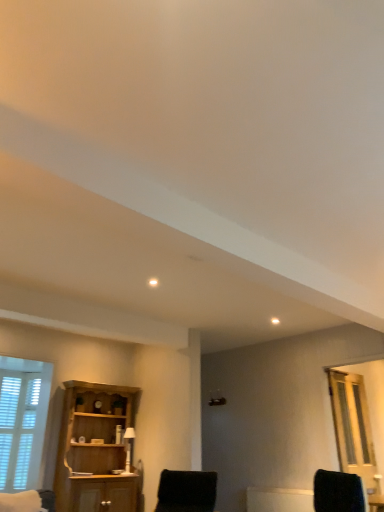
Question: Based on their positions, is black fuzzy chair at lower center located to the left or right of wooden cabinet at left?

Choices:
 (A) left
 (B) right

Answer: (B)

Question: Do you think black fuzzy chair at lower center is within wooden cabinet at left, or outside of it?

Choices:
 (A) outside
 (B) inside

Answer: (A)

Question: Which of these objects is positioned closest to the clear glass door at right?

Choices:
 (A) wooden cabinet at left
 (B) white wooden window at lower left
 (C) black fuzzy chair at lower center
 (D) white ceramic table lamp at center

Answer: (C)

Question: Estimate the real-world distances between objects in this image. Which object is closer to the clear glass door at right?

Choices:
 (A) white wooden window at lower left
 (B) black fuzzy chair at lower center
 (C) wooden cabinet at left
 (D) white ceramic table lamp at center

Answer: (B)